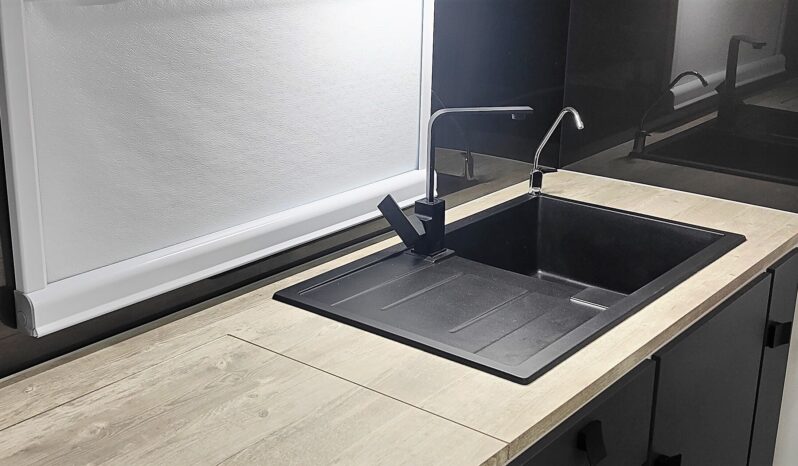
Mark all positions containing where you'd grab the cabinet door in the image. Your answer should be formatted as a list of tuples, i.e. [(x1, y1), (x2, y2), ...], where each tuple contains the x and y coordinates of a point satisfying the conditions above.

[(783, 327)]